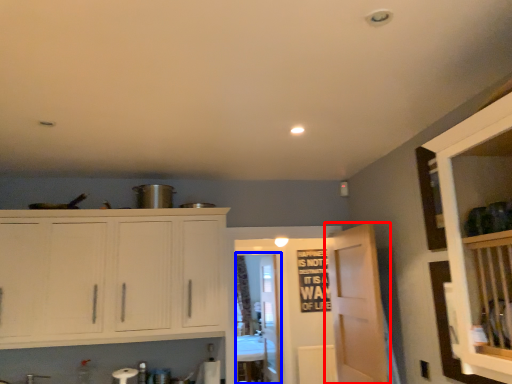
Question: Which of the following is the closest to the observer, door (highlighted by a red box) or glass door (highlighted by a blue box)?

Choices:
 (A) door
 (B) glass door

Answer: (A)